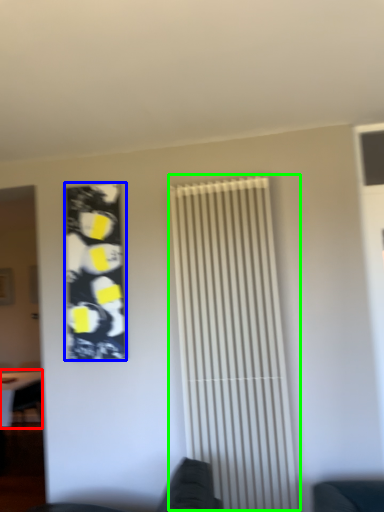
Question: Based on their relative distances, which object is nearer to table (highlighted by a red box)? Choose from poster (highlighted by a blue box) and shutter (highlighted by a green box).

Choices:
 (A) poster
 (B) shutter

Answer: (A)